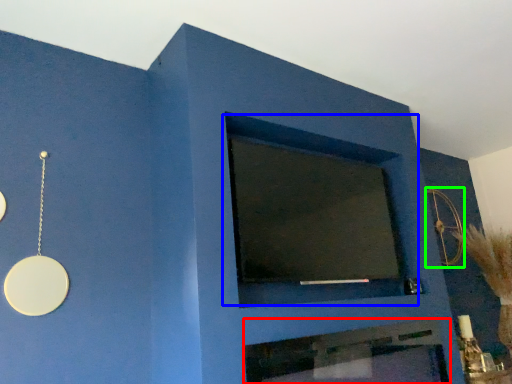
Question: Which object is positioned closest to fireplace (highlighted by a red box)? Select from window (highlighted by a blue box) and circle (highlighted by a green box).

Choices:
 (A) window
 (B) circle

Answer: (A)